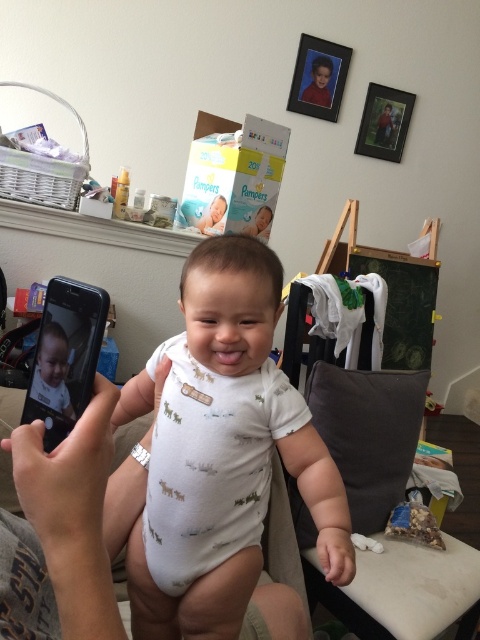
Between point (207, 374) and point (262, 458), which one is positioned behind?

The point (262, 458) is behind.

Is white soft onesie at center closer to the viewer compared to white cotton onesie at center?

Yes, white soft onesie at center is closer to the viewer.

Locate an element on the screen. white soft onesie at center is located at coordinates (225, 451).

You are a GUI agent. You are given a task and a screenshot of the screen. Output one action in this format:
    pyautogui.click(x=<x>, y=<y>)
    Task: Click on the white soft onesie at center
    
    Given the screenshot: What is the action you would take?
    click(225, 451)

Which is above, gray fabric armchair at lower right or black matte smartphone at left?

black matte smartphone at left

Is point (294, 481) positioned after point (27, 388)?

Yes, point (294, 481) is farther from viewer.

Who is more distant from viewer, (382,472) or (75,323)?

Positioned behind is point (382,472).

Where is `gray fabric armchair at lower right`? Image resolution: width=480 pixels, height=640 pixels. gray fabric armchair at lower right is located at coordinates (369, 433).

Image resolution: width=480 pixels, height=640 pixels. What do you see at coordinates (211, 461) in the screenshot?
I see `white cotton onesie at center` at bounding box center [211, 461].

Does white cotton onesie at center appear under gray fabric armchair at lower right?

No, white cotton onesie at center is not below gray fabric armchair at lower right.

Who is more distant from viewer, (177, 556) or (342, 422)?

The point (342, 422) is behind.

The width and height of the screenshot is (480, 640). In order to click on white cotton onesie at center in this screenshot , I will do `click(211, 461)`.